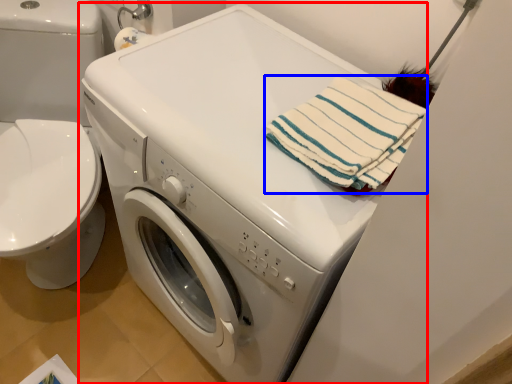
Question: Which object appears closest to the camera in this image, washing machine (highlighted by a red box) or beach towel (highlighted by a blue box)?

Choices:
 (A) washing machine
 (B) beach towel

Answer: (A)